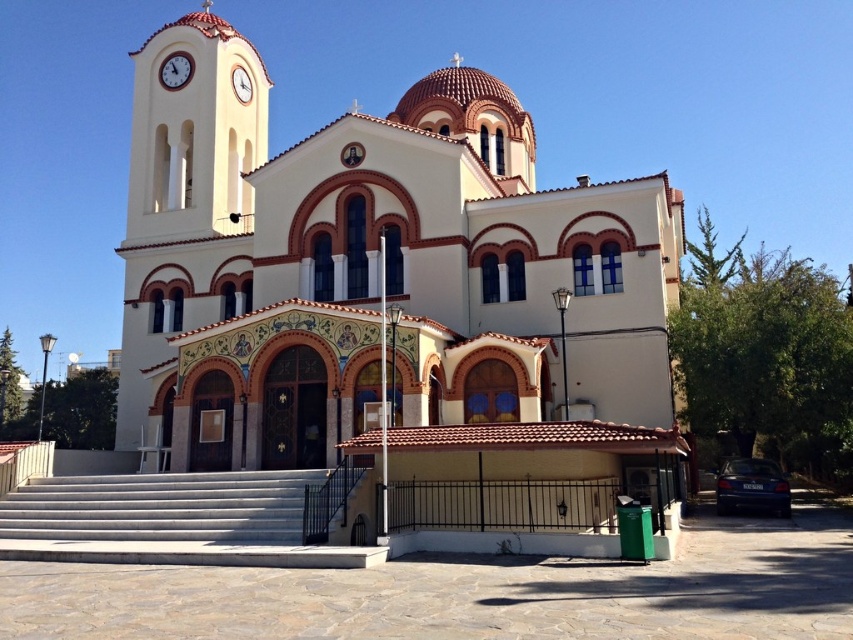
You are standing in front of a traditional Greek Orthodox church. There is a point marked at coordinates (38, 538). If you want to reach that point, which direction should you move relative to your current position?

The point at coordinates (38, 538) is 41.22 meters away from the viewer, so you should move forward towards it.

Based on the photo, you are standing in front of the Greek Orthodox church and notice the white stucco bell tower at upper left and the white glossy clock at upper left. Which of these two objects is positioned higher up on the building?

The white glossy clock at upper left is positioned higher up because the white stucco bell tower at upper left is located below it.

You are standing in front of the church and notice a point marked at coordinates (184, 214). What architectural feature does this point correspond to?

The point at coordinates (184, 214) corresponds to the white stucco bell tower at upper left.